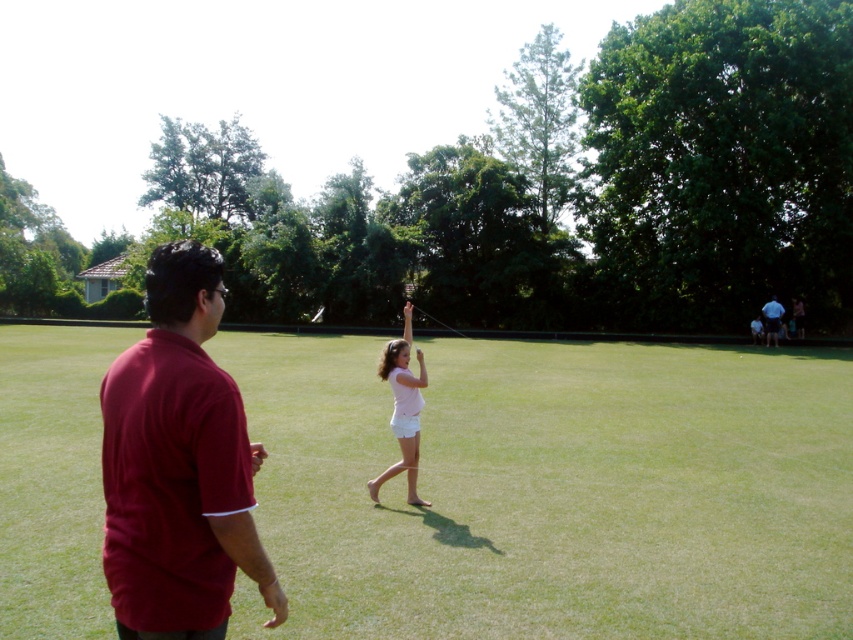
Which is behind, point (80, 360) or point (782, 321)?

The point (782, 321) is more distant.

Between point (798, 397) and point (778, 312), which one is positioned in front?

Point (798, 397) is in front.

You are a GUI agent. You are given a task and a screenshot of the screen. Output one action in this format:
    pyautogui.click(x=<x>, y=<y>)
    Task: Click on the smooth green grass at center
    The image size is (853, 640).
    Given the screenshot: What is the action you would take?
    pyautogui.click(x=552, y=490)

Based on the photo, which is more to the right, maroon cotton shirt at left or blue denim shorts at right?

blue denim shorts at right is more to the right.

Does maroon cotton shirt at left have a lesser height compared to blue denim shorts at right?

Yes.

Is point (245, 488) more distant than point (776, 305)?

No, (245, 488) is closer to viewer.

Locate an element on the screen. This screenshot has width=853, height=640. maroon cotton shirt at left is located at coordinates (178, 465).

Does smooth green grass at center have a smaller size compared to maroon cotton shirt at left?

No.

Between smooth green grass at center and maroon cotton shirt at left, which one appears on the right side from the viewer's perspective?

From the viewer's perspective, smooth green grass at center appears more on the right side.

Which is behind, point (759, 353) or point (196, 452)?

The point (759, 353) is behind.

Where is `smooth green grass at center`? The height and width of the screenshot is (640, 853). smooth green grass at center is located at coordinates (552, 490).